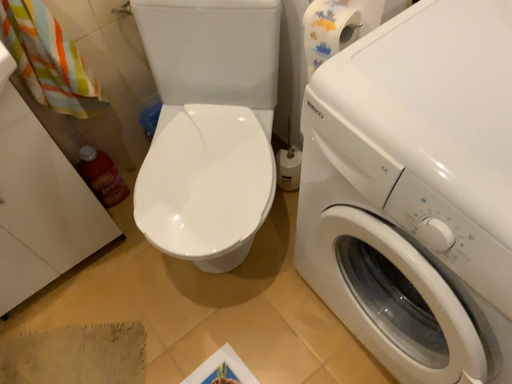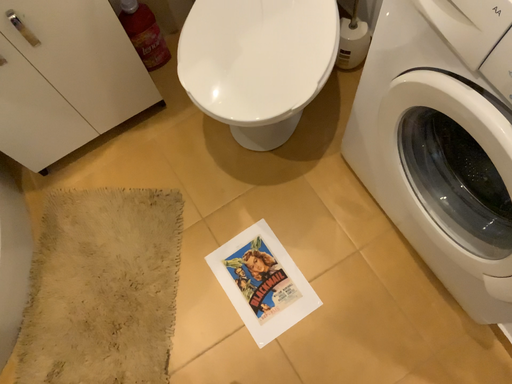
Question: How did the camera likely rotate when shooting the video?

Choices:
 (A) rotated upward
 (B) rotated downward

Answer: (B)